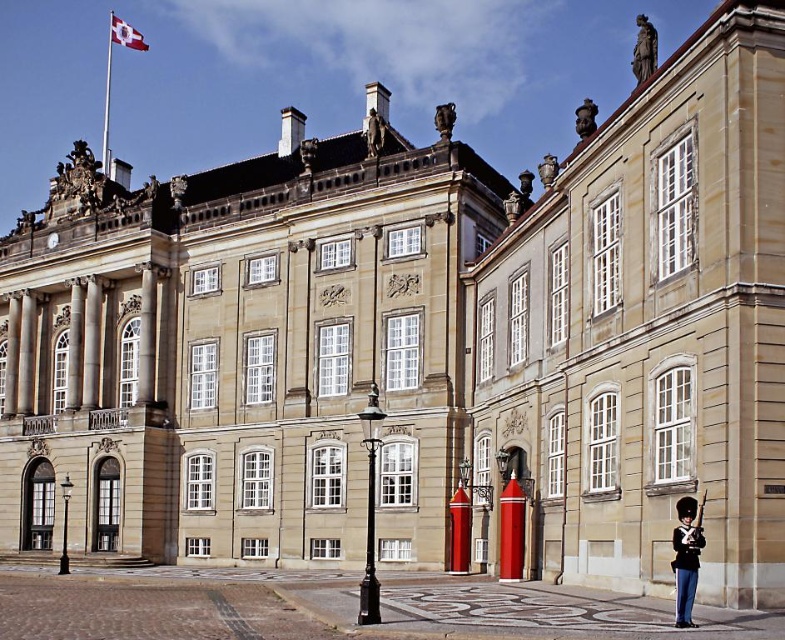
You are a tourist standing in front of the Amalienborg Palace. You notice a polished bronze statue at upper right and a white fabric flag at upper left. Which object is larger in size?

The polished bronze statue at upper right is bigger than the white fabric flag at upper left.

You are standing in front of the Amalienborg Palace in Copenhagen. You want to take a photo of the smooth stone building at center. If your camera can focus on objects up to 50 meters away, will you need to move closer or farther away to get a clear photo?

The smooth stone building at center is 57.58 meters away from the camera. Since the camera can focus up to 50 meters, you need to move closer to ensure the building is within the camera range.